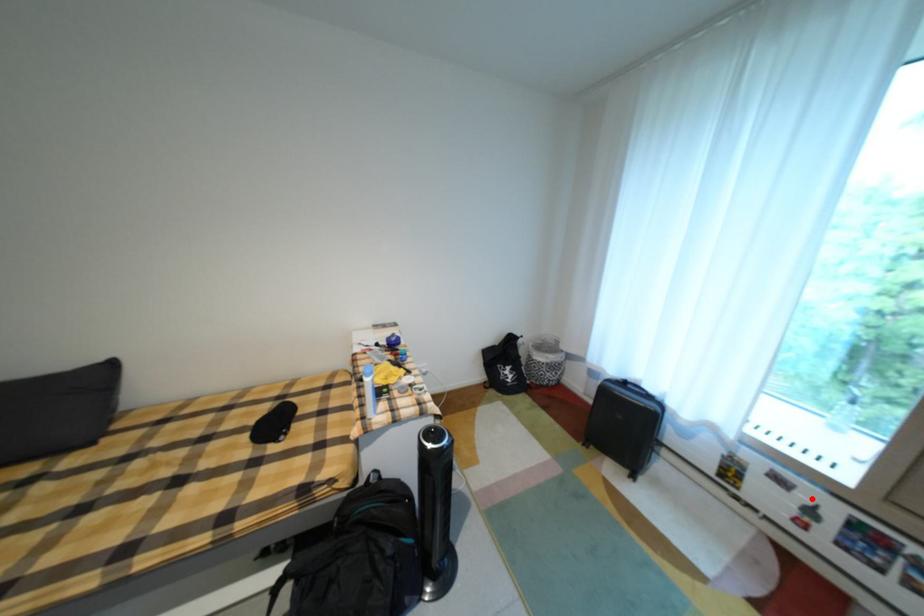
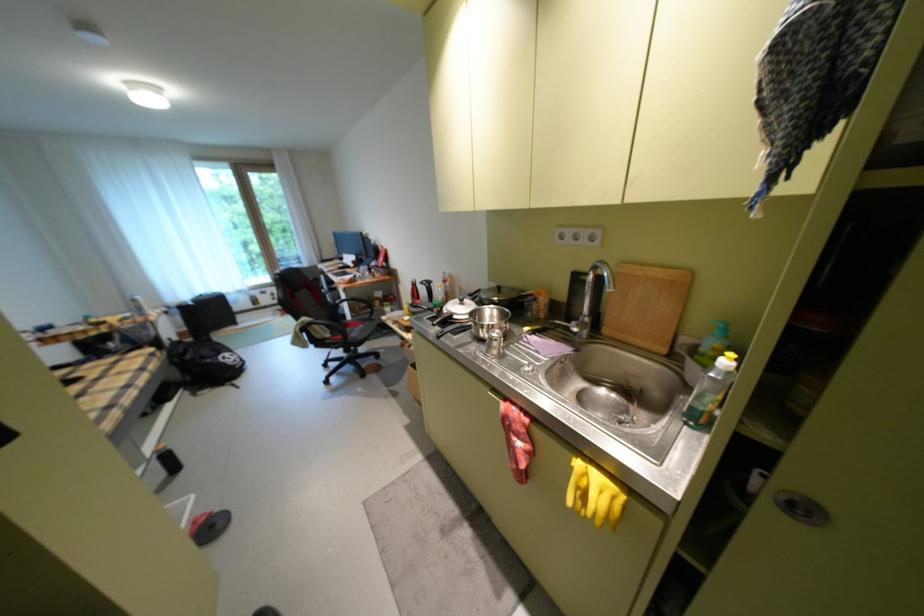
Where in the second image is the point corresponding to the highlighted location from the first image?

(280, 294)